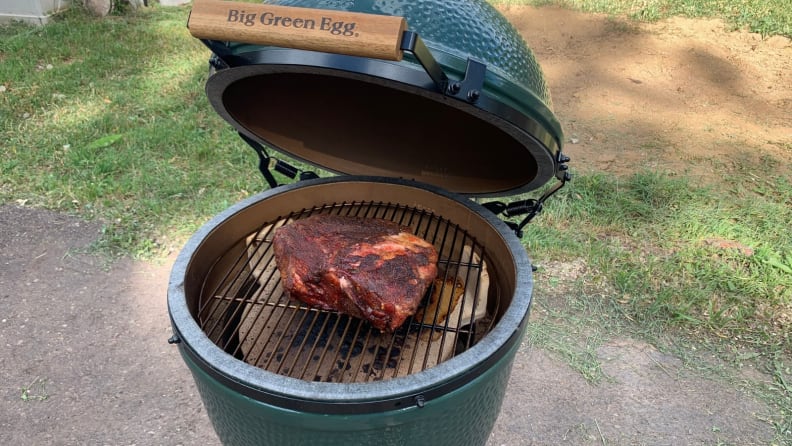
Image resolution: width=792 pixels, height=446 pixels. What are the coordinates of `handle` in the screenshot? It's located at (291, 29).